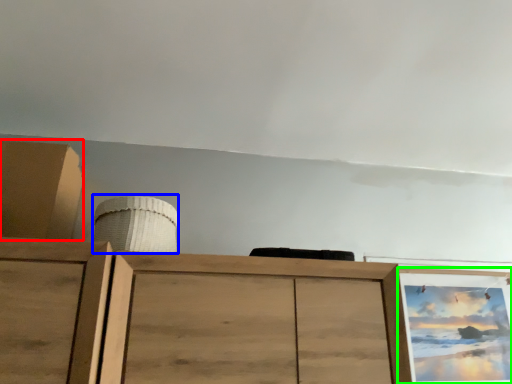
Question: Considering the real-world distances, which object is closest to cabinetry (highlighted by a red box)? job (highlighted by a blue box) or picture frame (highlighted by a green box).

Choices:
 (A) job
 (B) picture frame

Answer: (A)